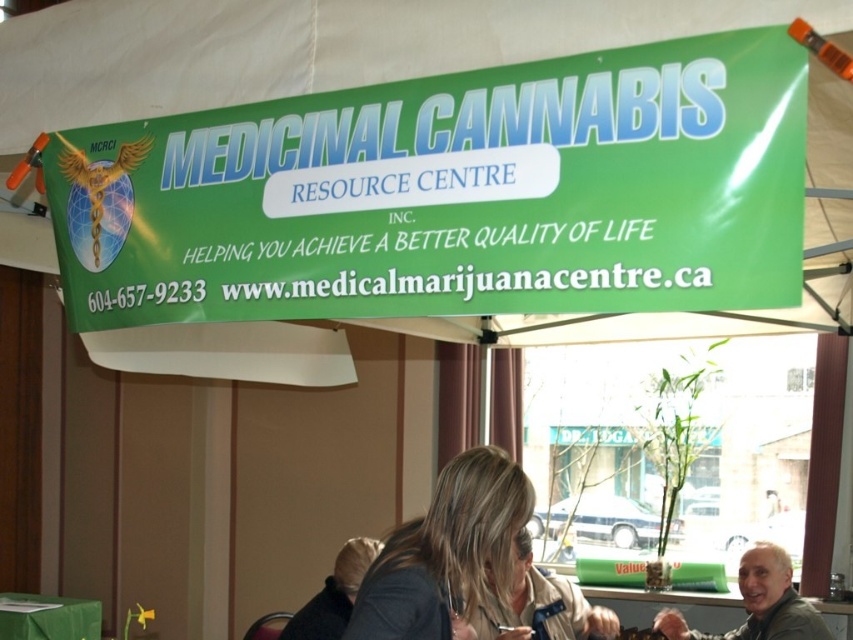
Can you confirm if green matte banner at upper center is bigger than green fabric table at lower left?

Yes.

Is green matte banner at upper center taller than green fabric table at lower left?

Indeed, green matte banner at upper center has a greater height compared to green fabric table at lower left.

Does point (524, 164) come farther from viewer compared to point (15, 632)?

That is False.

I want to click on green matte banner at upper center, so click(451, 193).

Is blonde hair at center to the left of green fabric table at lower left from the viewer's perspective?

In fact, blonde hair at center is to the right of green fabric table at lower left.

How distant is blonde hair at center from green fabric table at lower left?

A distance of 3.31 meters exists between blonde hair at center and green fabric table at lower left.

Who is more distant from viewer, (474, 502) or (83, 636)?

The point (83, 636) is behind.

The height and width of the screenshot is (640, 853). I want to click on blonde hair at center, so click(x=445, y=552).

Who is higher up, blonde hair at center or gray fabric jacket at lower right?

blonde hair at center

Does blonde hair at center appear on the left side of gray fabric jacket at lower right?

Yes, blonde hair at center is to the left of gray fabric jacket at lower right.

Describe the element at coordinates (445, 552) in the screenshot. This screenshot has height=640, width=853. I see `blonde hair at center` at that location.

The image size is (853, 640). I want to click on blonde hair at center, so click(x=445, y=552).